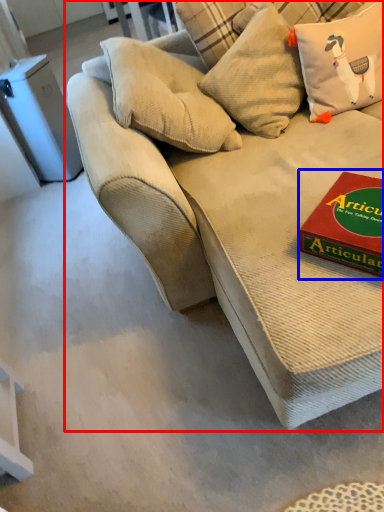
Question: Which of the following is the closest to the observer, studio couch (highlighted by a red box) or paperback book (highlighted by a blue box)?

Choices:
 (A) studio couch
 (B) paperback book

Answer: (A)